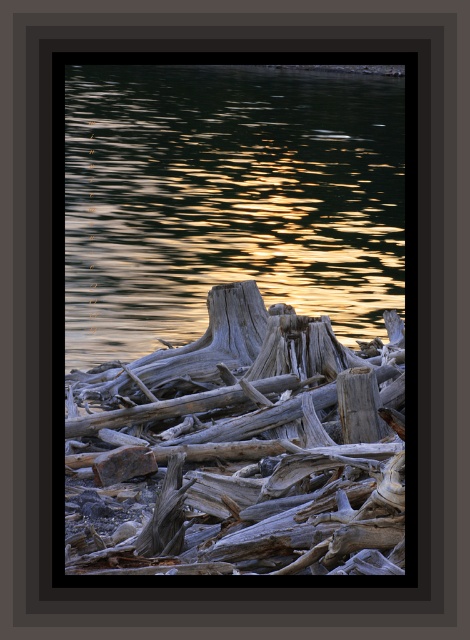
This screenshot has height=640, width=470. What do you see at coordinates (227, 198) in the screenshot? I see `glistening water at center` at bounding box center [227, 198].

Who is higher up, glistening water at center or gray rough wood at center?

glistening water at center is higher up.

Is point (244, 172) more distant than point (79, 387)?

Yes, point (244, 172) is farther from viewer.

Find the location of `glistening water at center`. glistening water at center is located at coordinates (227, 198).

Measure the distance from glistening water at center to gray weathered wood at center.

They are 13.68 meters apart.

Is point (175, 196) closer to viewer compared to point (288, 336)?

That is False.

In the scene shown: Who is more distant from viewer, (336, 212) or (235, 468)?

The point (336, 212) is more distant.

The width and height of the screenshot is (470, 640). Find the location of `glistening water at center`. glistening water at center is located at coordinates (227, 198).

Between gray weathered wood at center and gray rough wood at center, which one is positioned lower?

gray rough wood at center

Is gray weathered wood at center below gray rough wood at center?

No.

Between point (139, 436) and point (195, 346), which one is positioned behind?

Point (195, 346)

Where is `gray weathered wood at center`? gray weathered wood at center is located at coordinates (240, 449).